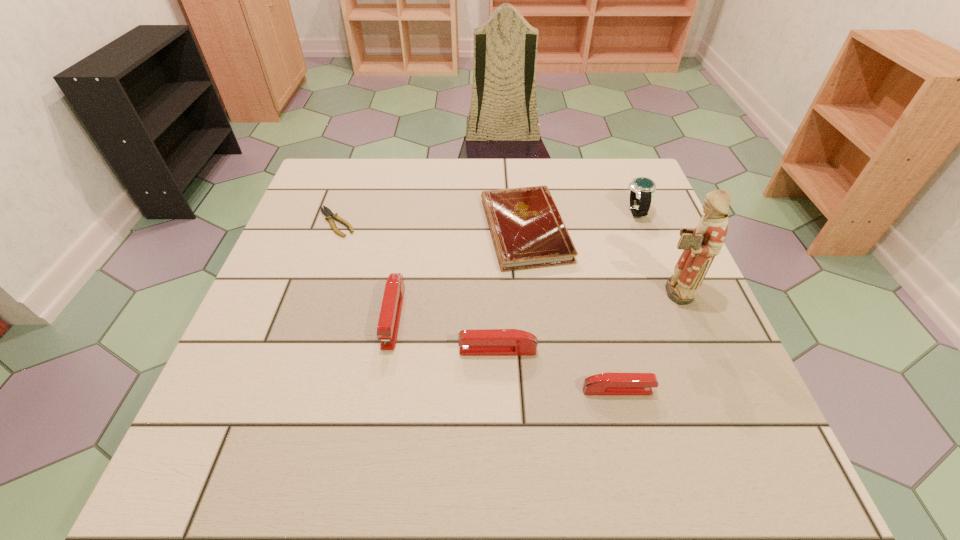
The height and width of the screenshot is (540, 960). I want to click on free space between the leftmost object and the sixth shortest object, so click(x=486, y=217).

This screenshot has width=960, height=540. Identify the location of free area in between the second shortest object and the figurine. (598, 260).

The height and width of the screenshot is (540, 960). I want to click on free spot between the notebook and the third shortest object, so click(571, 310).

Identify the location of blank region between the notebook and the second tallest stapler. (512, 290).

This screenshot has width=960, height=540. Find the location of `free point between the shortest object and the sixth object from right to left`. free point between the shortest object and the sixth object from right to left is located at coordinates (365, 269).

This screenshot has height=540, width=960. I want to click on vacant point located between the figurine and the third shortest object, so click(644, 341).

This screenshot has width=960, height=540. I want to click on empty location between the fourth tallest object and the shortest object, so click(418, 286).

Image resolution: width=960 pixels, height=540 pixels. Identify the location of free space that is in between the watch and the tallest object. (653, 251).

Identify which object is the sixth closest to the sixth shortest object. Please provide its 2D coordinates. Your answer should be formatted as a tuple, i.e. [(x, y)], where the tuple contains the x and y coordinates of a point satisfying the conditions above.

[(331, 216)]

Identify which object is the fifth closest to the leftmost stapler. Please provide its 2D coordinates. Your answer should be formatted as a tuple, i.e. [(x, y)], where the tuple contains the x and y coordinates of a point satisfying the conditions above.

[(701, 244)]